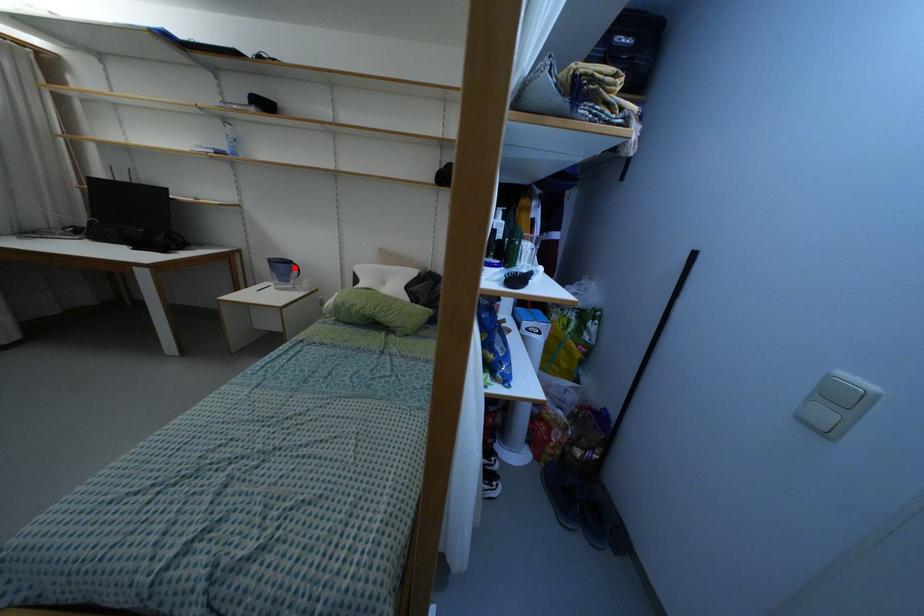
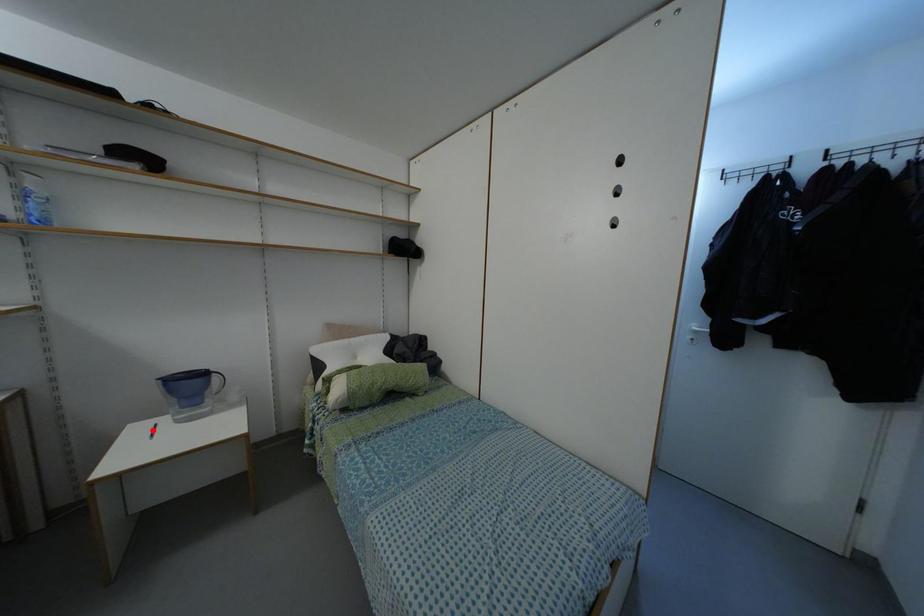
I am providing you with two images of the same scene from different viewpoints. A red point is marked on the first image and another point is marked on the second image. Do the highlighted points in image1 and image2 indicate the same real-world spot?

No